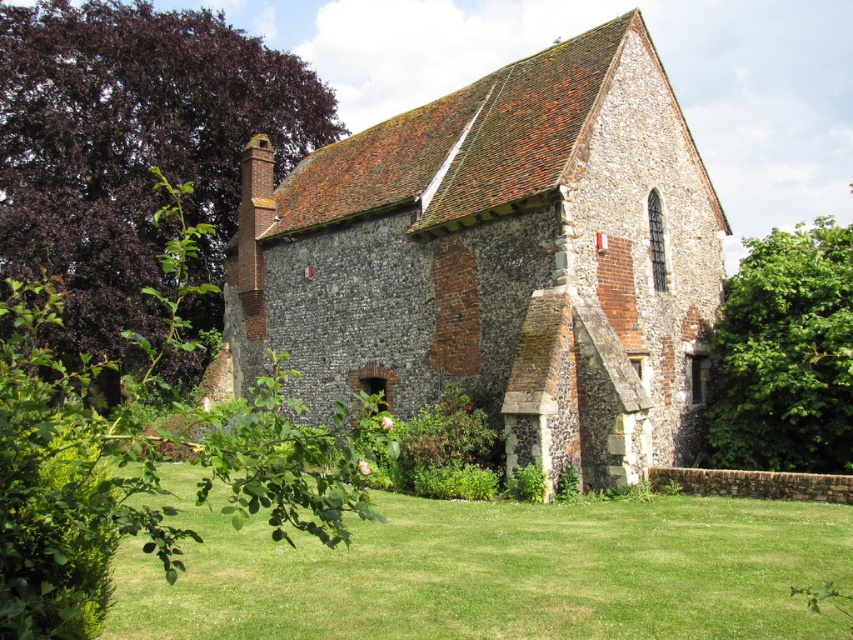
You are a photographer planning to capture both the brown stone church at center and the green leafy tree at right in one frame. Given their sizes, which object should you position closer to the camera to ensure both fit within the shot?

Since the brown stone church at center is narrower than the green leafy tree at right, you should position the green leafy tree at right closer to the camera to ensure both fit within the shot.

You are a gardener who needs to mow the lawn. You see the green grass at lower center and the green leafy tree at right. Which one is shorter and requires mowing?

The green grass at lower center is shorter than the green leafy tree at right. Since grass typically requires mowing, you should focus on the green grass at lower center.

You are standing in a park and see the historic stone building with green grass at lower center and a green leafy tree at right. Which object is closer to you?

The green grass at lower center is closer to you because it is in front of the green leafy tree at right.